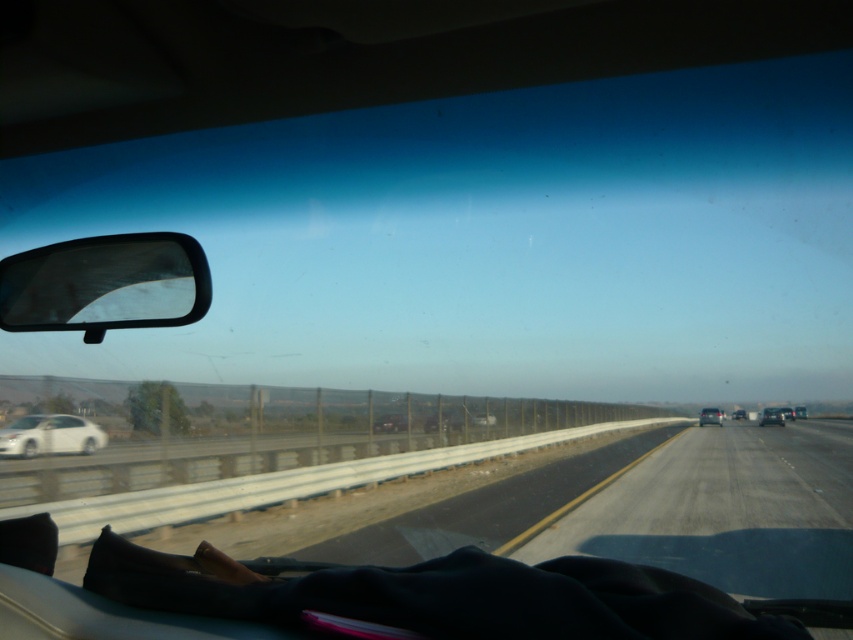
You are a passenger in a car and looking out the window. You see a metallic silver sedan at center and a black glossy sedan at center on the highway. Which one is positioned to the left?

The metallic silver sedan at center is positioned to the left of the black glossy sedan at center.

You are a passenger in a metallic silver sedan at center and notice another metallic silver sedan at right on the highway. Which car appears narrower from your viewpoint?

The metallic silver sedan at center appears narrower than the metallic silver sedan at right from your viewpoint.